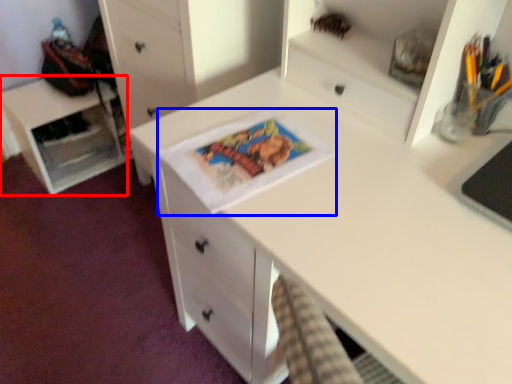
Question: Which object appears closest to the camera in this image, cabinetry (highlighted by a red box) or comic book (highlighted by a blue box)?

Choices:
 (A) cabinetry
 (B) comic book

Answer: (B)